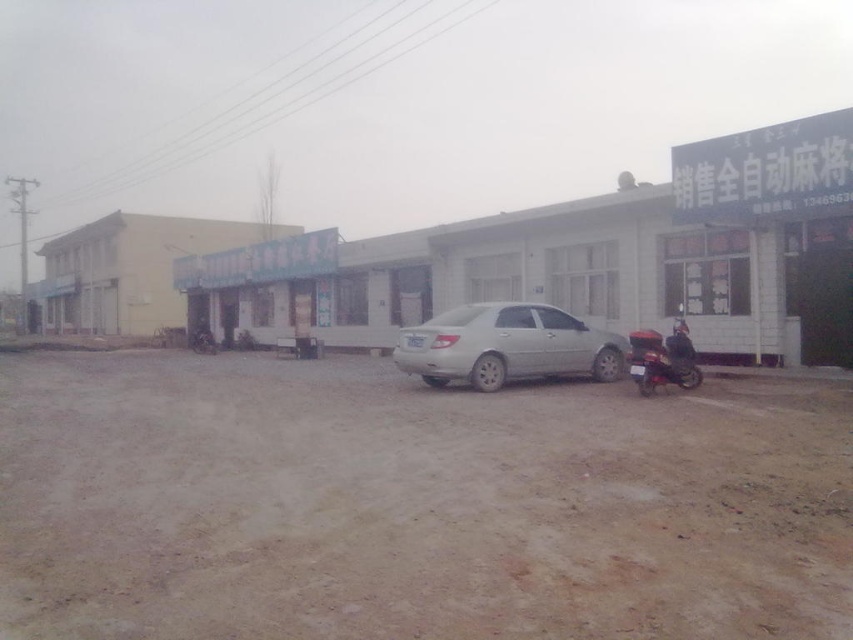
You are a delivery person trying to park your van in the area shown. The van is wider than the silver metallic car at center. Based on the scene, can you safely park your van on the brown sandy dirt track at lower center without overlapping the car?

The brown sandy dirt track at lower center is to the left of the silver metallic car at center, so yes, you can park your van there as long as you position it to the left side of the car without overlapping.

You are a delivery person trying to park your red scooter closer to the yellow building with the blue awning. Based on the scene, can the silver metallic car at center allow enough space for the metallic red scooter at right to move towards the yellow building?

The silver metallic car at center is smaller than the metallic red scooter at right, so there might not be enough space for the metallic red scooter at right to move around the silver metallic car at center towards the yellow building.

You are a delivery person who needs to drive a small cart along the brown sandy dirt track at lower center and pass by the metallic red scooter at right. Can you safely navigate your cart through this path without hitting the scooter?

The brown sandy dirt track at lower center is positioned on the left side of metallic red scooter at right, so the cart can safely navigate along the dirt track and pass by the scooter without collision as they are aligned side by side.